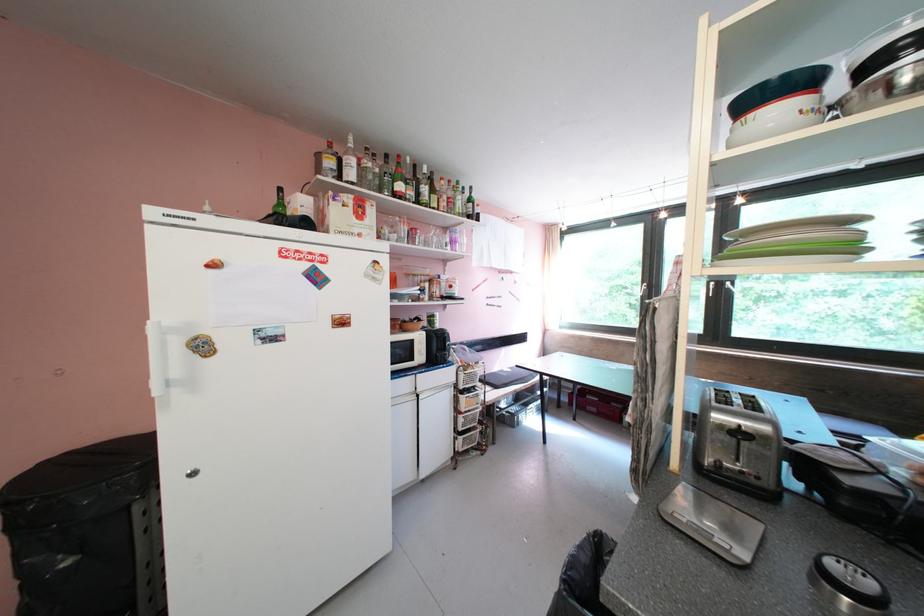
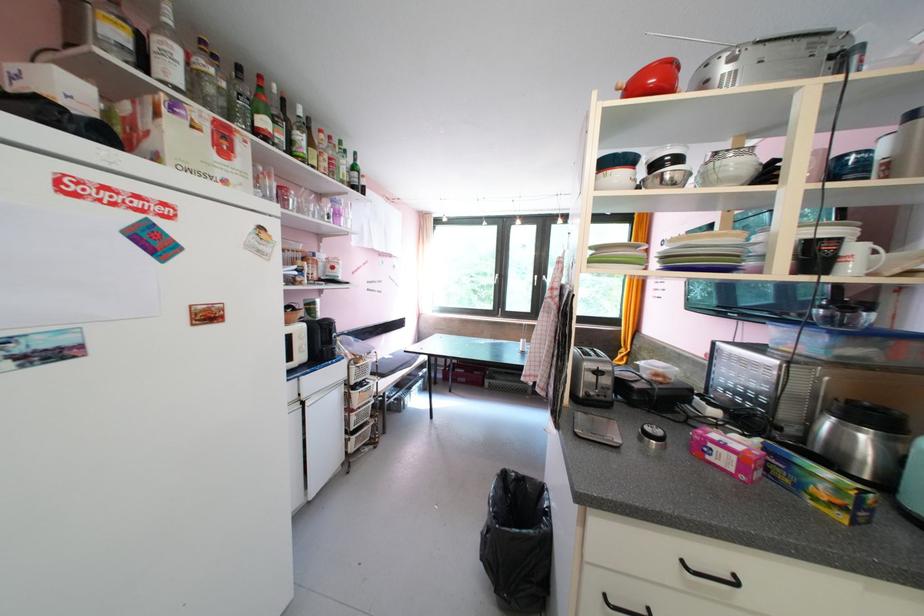
Where in the second image is the point corresponding to point 408,188 from the first image?

(273, 124)